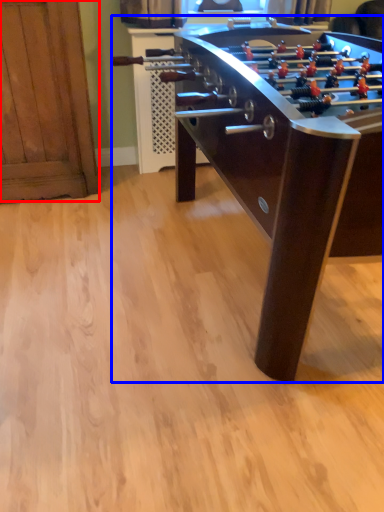
Question: Which point is closer to the camera, furniture (highlighted by a red box) or table (highlighted by a blue box)?

Choices:
 (A) furniture
 (B) table

Answer: (B)